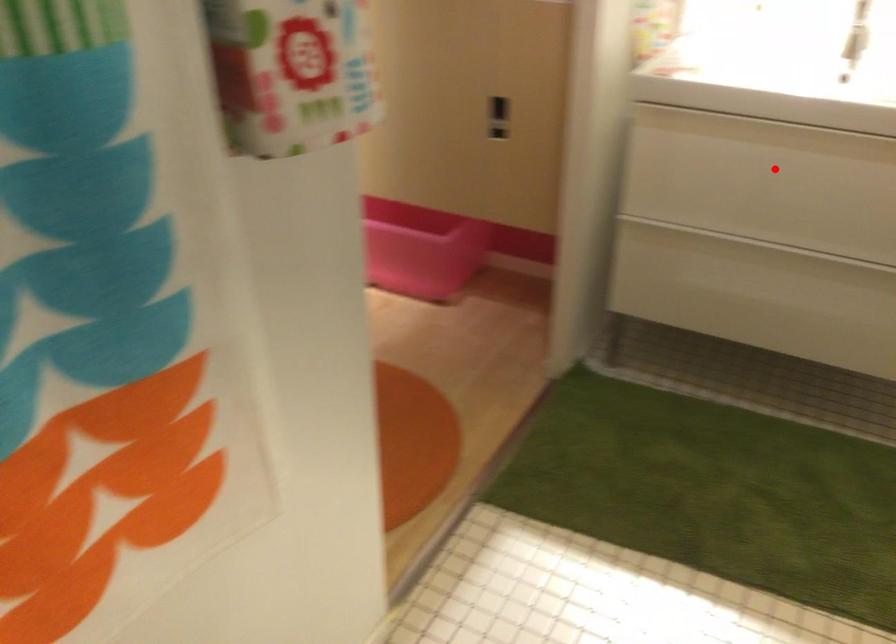
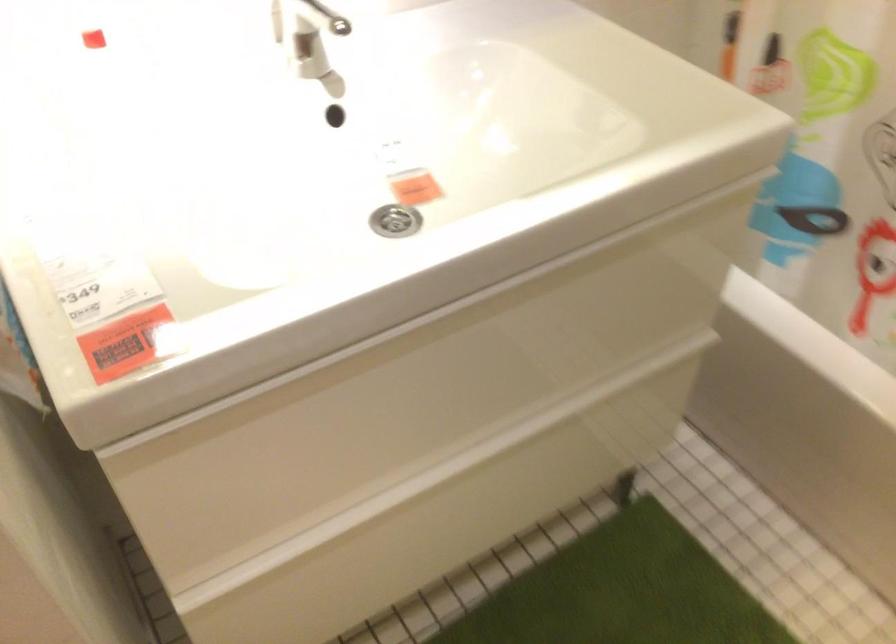
Question: I am providing you with two images of the same scene from different viewpoints. Image1 has a red point marked. In image2, the corresponding 3D location appears at what relative position? Reply with the corresponding letter.

Choices:
 (A) Closer
 (B) Farther

Answer: (A)